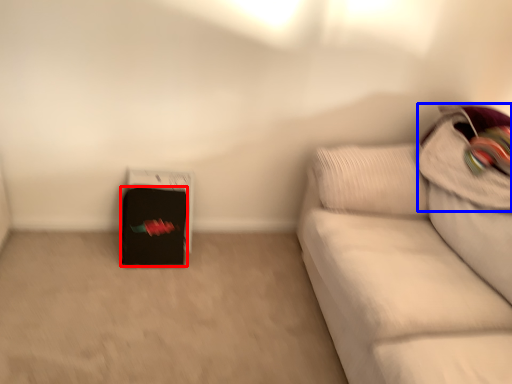
Question: Which of the following is the farthest to the observer, luggage (highlighted by a red box) or pillow (highlighted by a blue box)?

Choices:
 (A) luggage
 (B) pillow

Answer: (A)